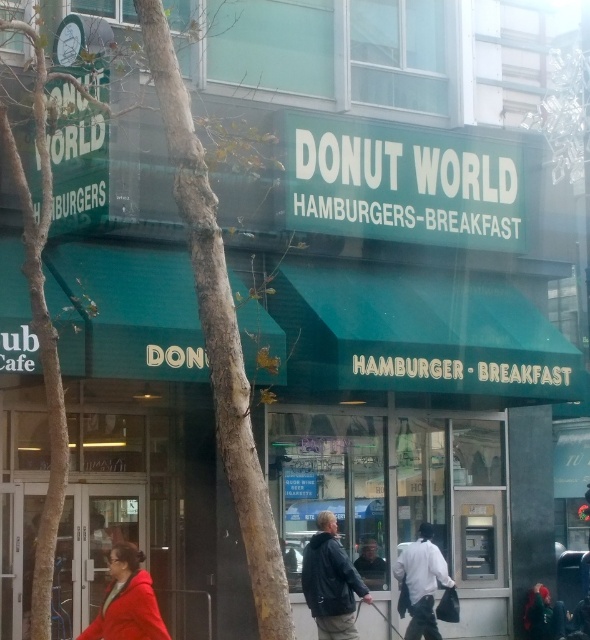
Who is positioned more to the right, matte red coat at lower left or dark gray jacket at center?

dark gray jacket at center

At what (x,y) coordinates should I click in order to perform the action: click on matte red coat at lower left. Please return your answer as a coordinate pair (x, y). The image size is (590, 640). Looking at the image, I should click on (127, 600).

Can you confirm if white matte jacket at center is positioned above dark gray jacket at center?

No, white matte jacket at center is not above dark gray jacket at center.

Measure the distance between point (438, 636) and camera.

Point (438, 636) and camera are 17.54 meters apart.

Image resolution: width=590 pixels, height=640 pixels. What are the coordinates of `white matte jacket at center` in the screenshot? It's located at (421, 582).

Between point (319, 612) and point (81, 636), which one is positioned behind?

Point (319, 612)

Is point (342, 602) farther from camera compared to point (132, 605)?

Yes, point (342, 602) is farther from viewer.

In order to click on leather jacket at center in this screenshot , I will do `click(330, 580)`.